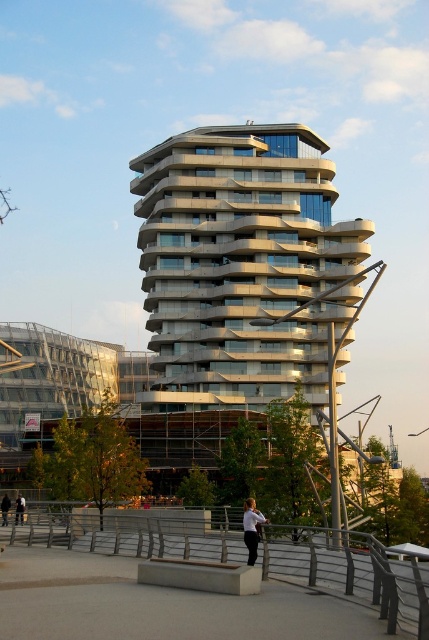
Question: Estimate the real-world distances between objects in this image. Which object is farther from the dark gray jacket at lower center?

Choices:
 (A) white fabric shirt at center
 (B) dark gray pants at lower left
 (C) metallic glass tower at center

Answer: (C)

Question: Which of the following is the closest to the observer?

Choices:
 (A) (8, 506)
 (B) (323, 568)

Answer: (B)

Question: Is metallic glass tower at center bigger than dark gray pants at lower left?

Choices:
 (A) no
 (B) yes

Answer: (B)

Question: Among these objects, which one is farthest from the camera?

Choices:
 (A) white fabric shirt at center
 (B) metal/textured rail at lower center

Answer: (A)

Question: Is white fabric shirt at center closer to camera compared to dark gray jacket at lower center?

Choices:
 (A) no
 (B) yes

Answer: (B)

Question: Is metal/textured rail at lower center positioned in front of white fabric shirt at center?

Choices:
 (A) no
 (B) yes

Answer: (B)